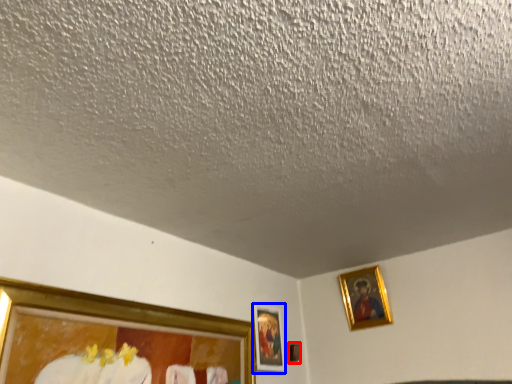
Question: Which point is closer to the camera, picture frame (highlighted by a red box) or picture frame (highlighted by a blue box)?

Choices:
 (A) picture frame
 (B) picture frame

Answer: (B)